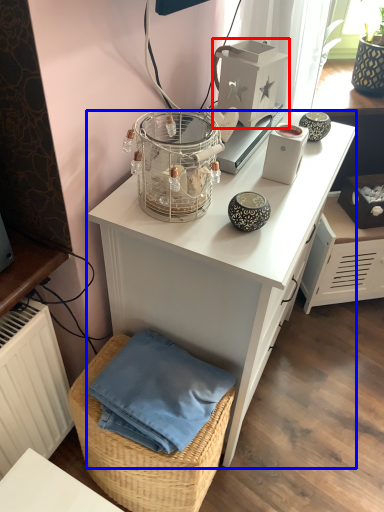
Question: Among these objects, which one is farthest to the camera, appliance (highlighted by a red box) or desk (highlighted by a blue box)?

Choices:
 (A) appliance
 (B) desk

Answer: (A)